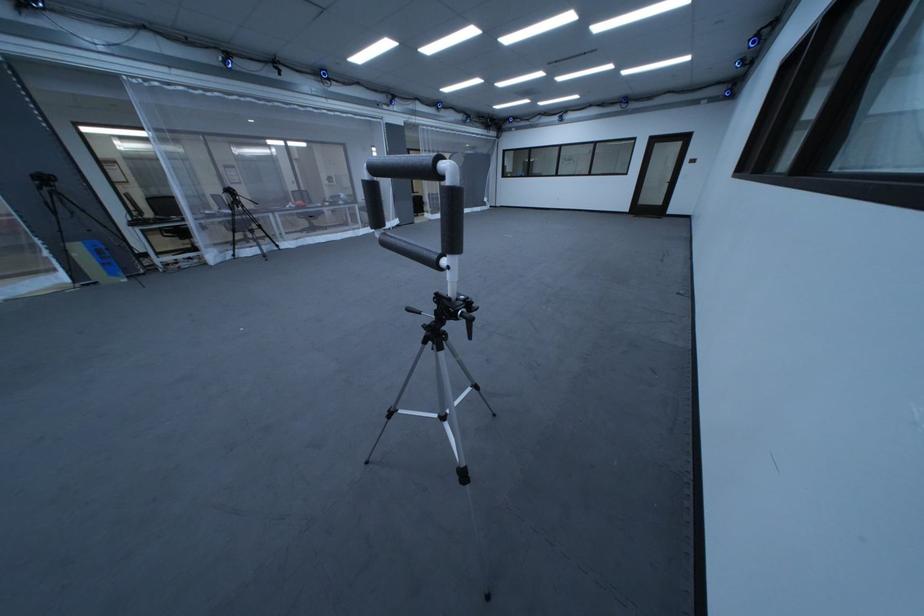
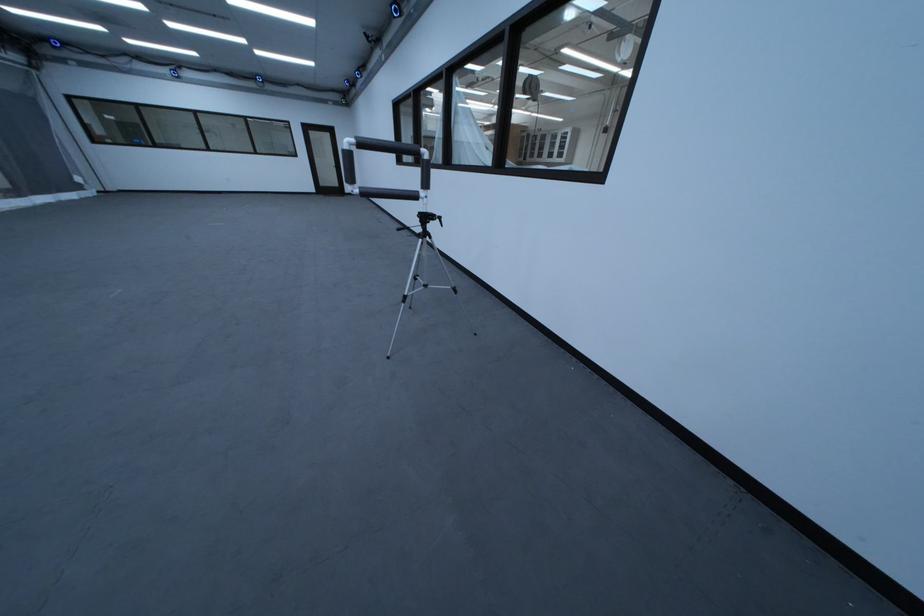
Where in the second image is the point corresponding to the point at 675,204 from the first image?

(351, 185)